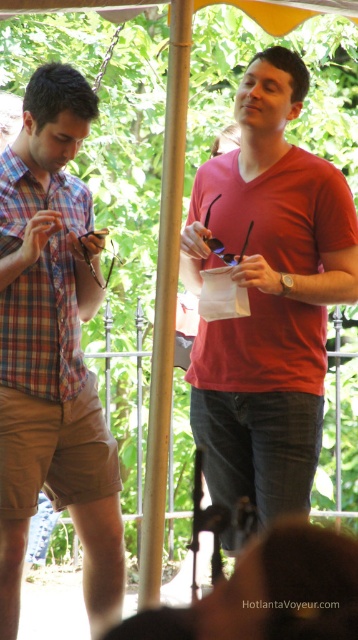
You are a fashion designer observing two people at an outdoor event. You notice the plaid cotton shorts at left and the plaid cotton shirt at left. Can you determine if the distance between these two items is sufficient for a person to comfortably wear both items together?

The distance between the plaid cotton shorts at left and plaid cotton shirt at left is 5.63 inches, which is sufficient for a person to comfortably wear both items together as they are separate garments worn on different parts of the body.

You are a photographer trying to capture a clear photo of the plaid cotton shirt at left and the plaid cotton shorts at left. Which one should you focus on first to ensure both are in focus?

The plaid cotton shorts at left is in front of the plaid cotton shirt at left, so focus on the plaid cotton shorts at left first to ensure both are in focus.

Based on the photo, you are a photographer taking a picture of the matte red shirt at center and the plaid cotton shirt at left. Which shirt should you focus on first to ensure both are in frame?

The matte red shirt at center is in front of the plaid cotton shirt at left, so you should focus on the matte red shirt at center first to ensure both are in frame.